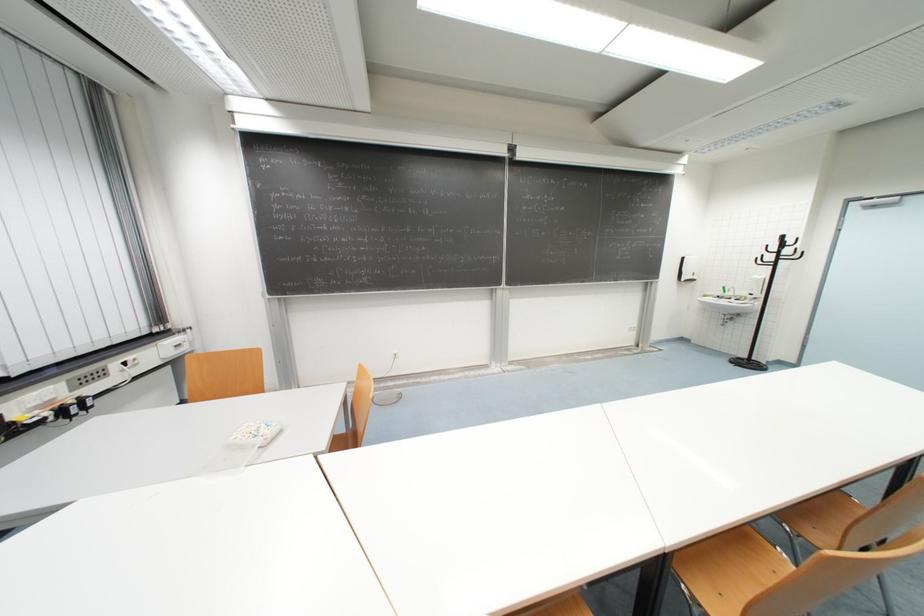
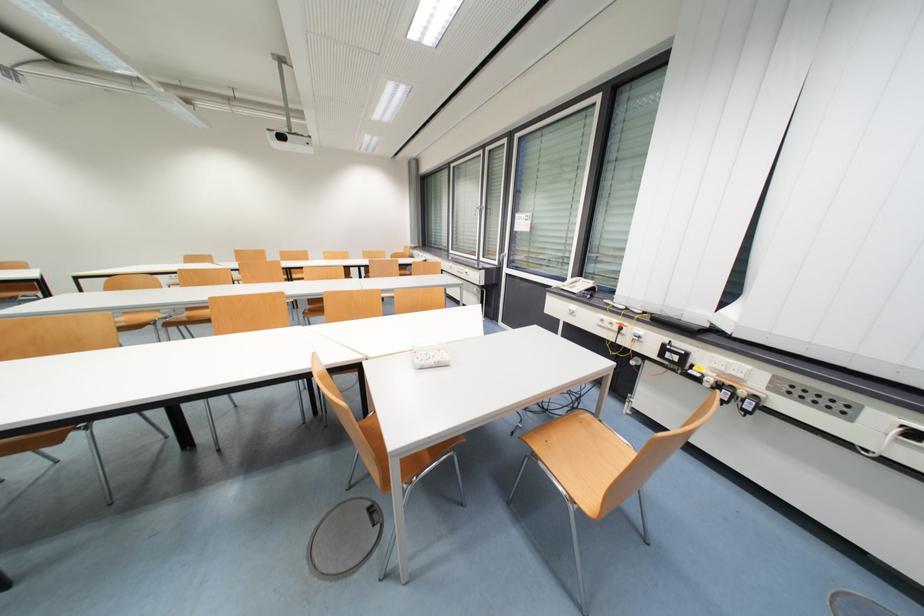
Locate, in the second image, the point that corresponds to point (42, 406) in the first image.

(727, 371)